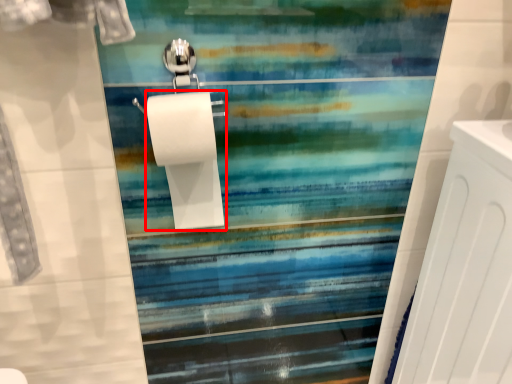
Question: In this image, where is toilet paper (annotated by the red box) located relative to radiator?

Choices:
 (A) right
 (B) left

Answer: (B)